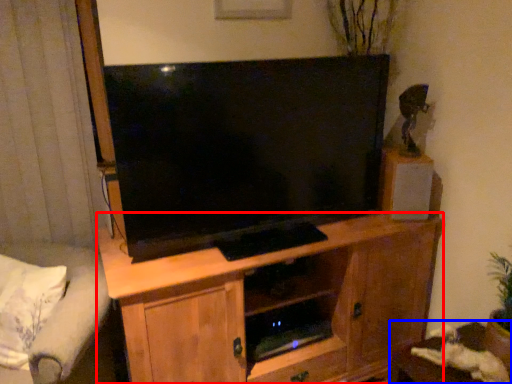
Question: Which object appears closest to the camera in this image, cabinetry (highlighted by a red box) or table (highlighted by a blue box)?

Choices:
 (A) cabinetry
 (B) table

Answer: (A)